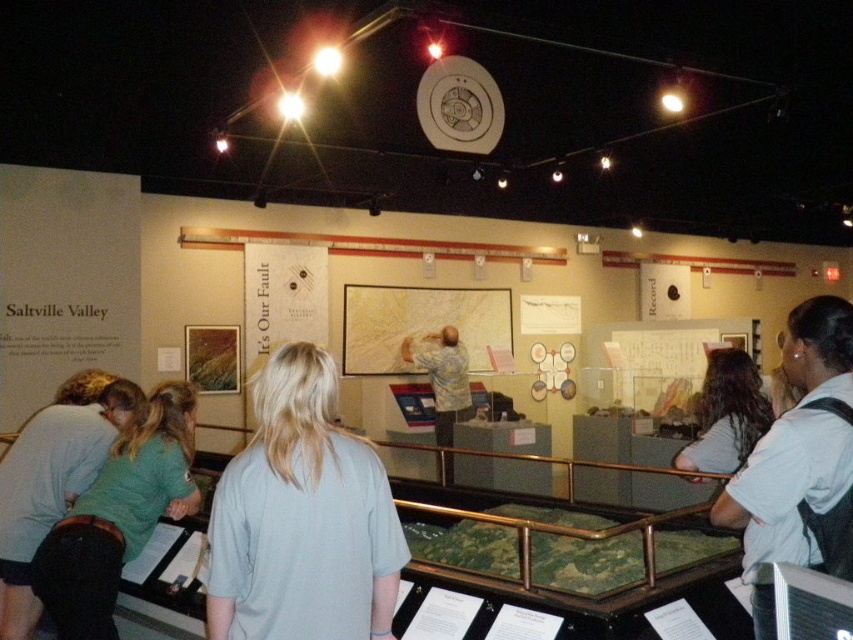
Question: Is light gray shirt at center wider than green fabric shirt at lower left?

Choices:
 (A) yes
 (B) no

Answer: (B)

Question: Does green fabric shirt at lower left appear on the left side of blonde hair at center?

Choices:
 (A) yes
 (B) no

Answer: (A)

Question: Based on their relative distances, which object is nearer to the blonde hair at center?

Choices:
 (A) green fabric shirt at lower left
 (B) light blue shirt at center
 (C) light gray shirt at center

Answer: (B)

Question: Does light gray shirt at center appear on the right side of blonde hair at center?

Choices:
 (A) no
 (B) yes

Answer: (A)

Question: Which of the following is the farthest from the observer?

Choices:
 (A) (741, 417)
 (B) (252, 445)

Answer: (A)

Question: Which point is farther to the camera?

Choices:
 (A) blonde hair at center
 (B) light blue shirt at center
 (C) light gray shirt at center
 (D) green fabric shirt at lower left

Answer: (A)